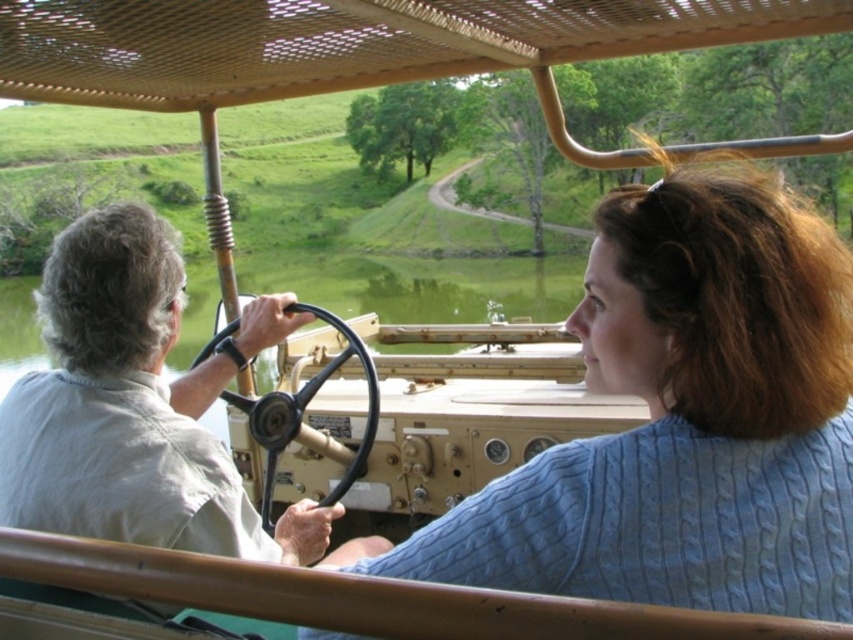
Is blue cable-knit sweater at center to the left of black rubber steering wheel at center from the viewer's perspective?

In fact, blue cable-knit sweater at center is to the right of black rubber steering wheel at center.

Looking at this image, who is taller, blue cable-knit sweater at center or black rubber steering wheel at center?

black rubber steering wheel at center

Does point (547, 476) lie in front of point (361, 468)?

Yes, point (547, 476) is in front of point (361, 468).

At what (x,y) coordinates should I click in order to perform the action: click on blue cable-knit sweater at center. Please return your answer as a coordinate pair (x, y). Image resolution: width=853 pixels, height=640 pixels. Looking at the image, I should click on (683, 420).